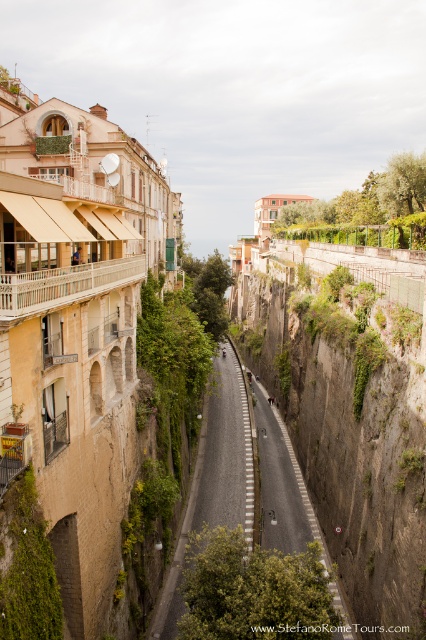
You are a hiker standing on the asphalt road at center. You look towards the brown rough cliff at center. How does the height of the cliff compare to the road?

The brown rough cliff at center is taller than the asphalt road at center.

You are standing at the point labeled as point (350, 412) in the image. What type of terrain are you currently standing on?

The point (350, 412) corresponds to a brown rough cliff at center, so you are standing on a brown rough cliff.